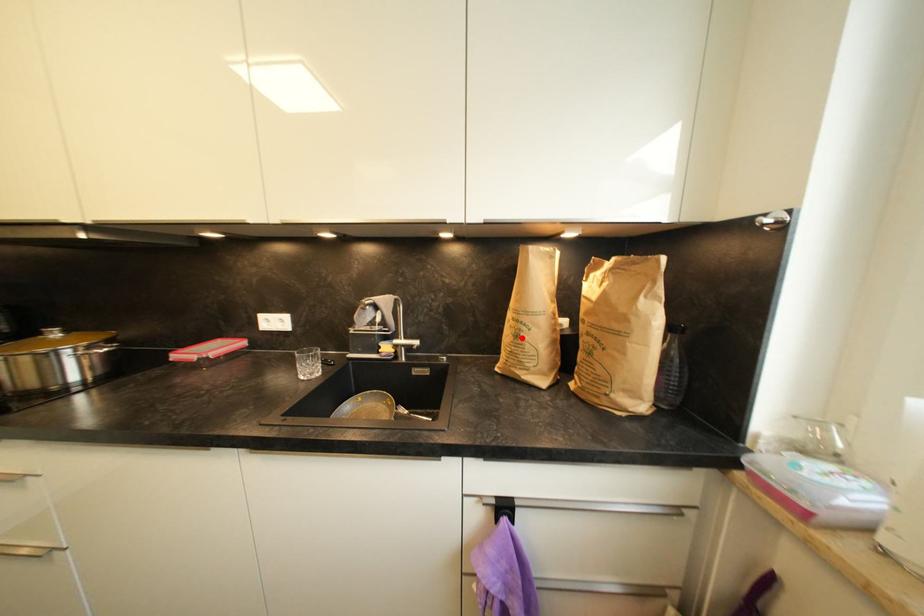
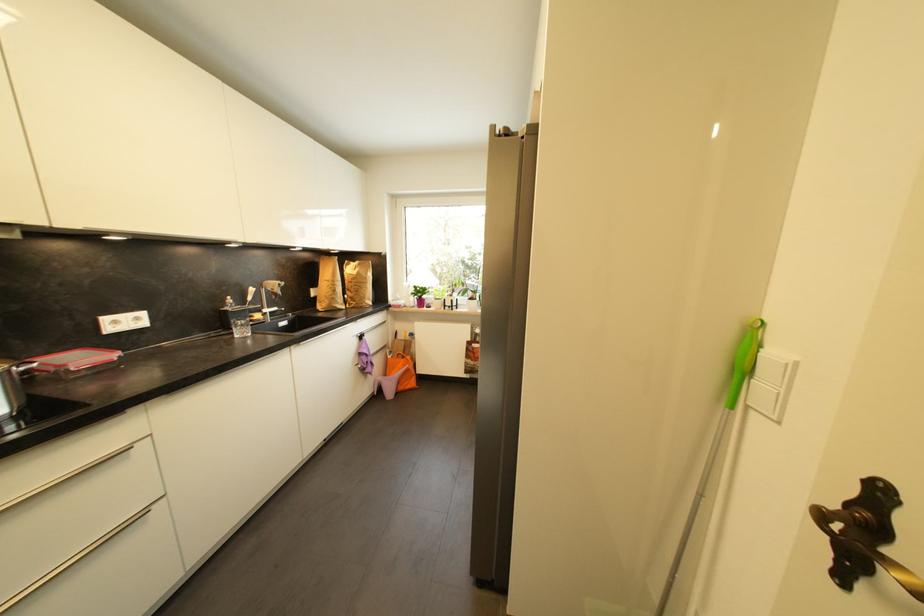
Question: I am providing you with two images of the same scene from different viewpoints. A red point is marked on the first image. Is the red point's position out of view in image 2?

Choices:
 (A) Yes
 (B) No

Answer: (B)